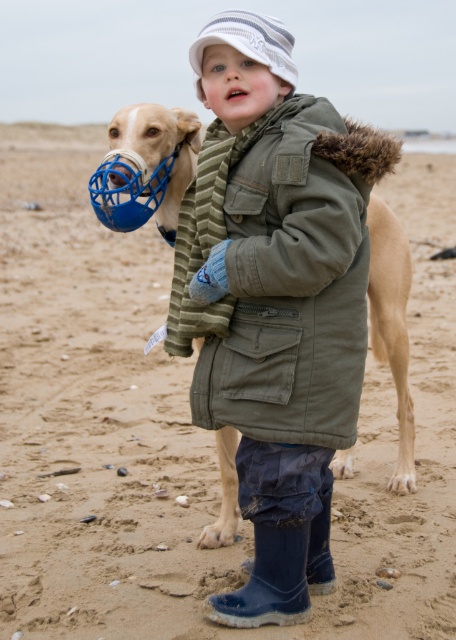
Question: Which of the following is the closest to the observer?

Choices:
 (A) blue rubber nose at center
 (B) white striped knit cap at upper center

Answer: (B)

Question: Is white striped knit cap at upper center closer to camera compared to blue rubber nose at center?

Choices:
 (A) yes
 (B) no

Answer: (A)

Question: Which object appears farthest from the camera in this image?

Choices:
 (A) white striped knit cap at upper center
 (B) olive-green fabric coat at center
 (C) blue rubber nose at center

Answer: (C)

Question: Is white striped knit cap at upper center positioned in front of pink matte lips at center?

Choices:
 (A) no
 (B) yes

Answer: (B)

Question: Does olive-green fabric coat at center come in front of blue rubber nose at center?

Choices:
 (A) yes
 (B) no

Answer: (A)

Question: Which of the following is the farthest from the observer?

Choices:
 (A) blue rubber nose at center
 (B) olive-green fabric coat at center
 (C) pink matte lips at center
 (D) white striped knit cap at upper center

Answer: (C)